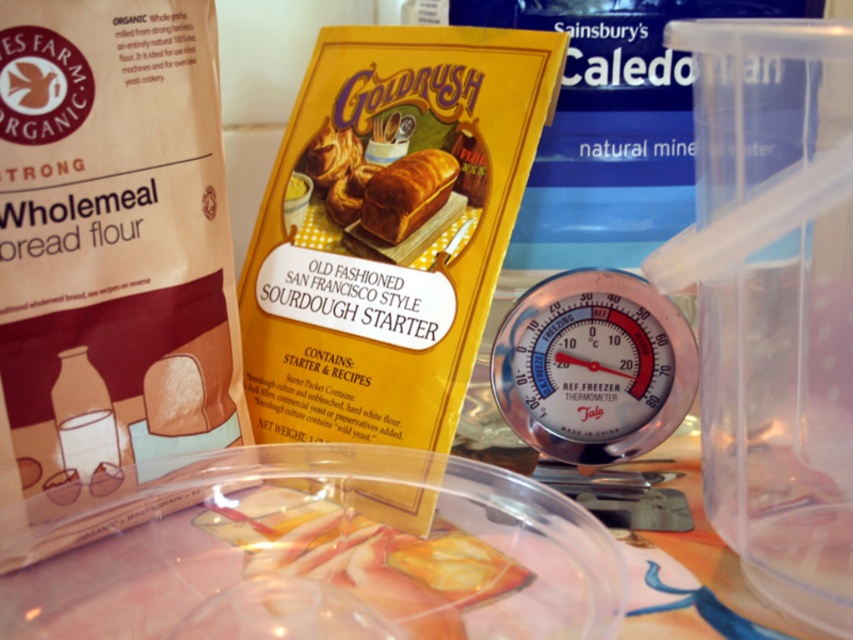
Locate an element on the screen. transparent plastic thermometer at center is located at coordinates (593, 368).

Between point (653, 524) and point (389, 228), which one is positioned behind?

The point (389, 228) is behind.

Where is `transparent plastic thermometer at center`? The width and height of the screenshot is (853, 640). transparent plastic thermometer at center is located at coordinates (593, 368).